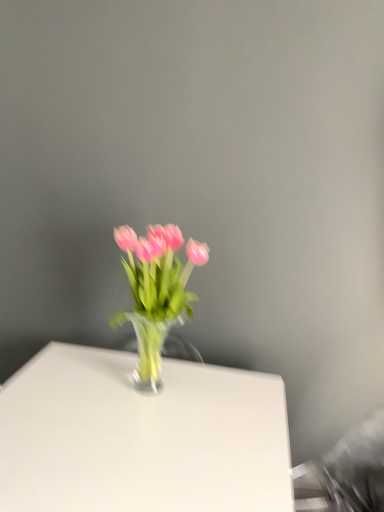
Identify the location of pink glass vase at center. This screenshot has width=384, height=512. (156, 292).

What do you see at coordinates (156, 292) in the screenshot? I see `pink glass vase at center` at bounding box center [156, 292].

Measure the distance between point (105, 392) and camera.

They are 3.97 feet apart.

Image resolution: width=384 pixels, height=512 pixels. Describe the element at coordinates (141, 437) in the screenshot. I see `white glossy table at center` at that location.

You are a GUI agent. You are given a task and a screenshot of the screen. Output one action in this format:
    pyautogui.click(x=<x>, y=<y>)
    Task: Click on the white glossy table at center
    This screenshot has height=512, width=384.
    Given the screenshot: What is the action you would take?
    pyautogui.click(x=141, y=437)

Find the location of a particular element. This screenshot has width=384, height=512. pink glass vase at center is located at coordinates (156, 292).

Between white glossy table at center and pink glass vase at center, which one appears on the right side from the viewer's perspective?

Positioned to the right is pink glass vase at center.

From the picture: Relative to pink glass vase at center, is white glossy table at center in front or behind?

white glossy table at center is in front of pink glass vase at center.

Does point (89, 468) lie in front of point (165, 230)?

Yes, point (89, 468) is closer to viewer.

From the image's perspective, is white glossy table at center above pink glass vase at center?

No.

From a real-world perspective, is white glossy table at center on top of pink glass vase at center?

No, from a real-world perspective, white glossy table at center is not above pink glass vase at center.

Which object is wider, white glossy table at center or pink glass vase at center?

Wider between the two is white glossy table at center.

From their relative heights in the image, would you say white glossy table at center is taller or shorter than pink glass vase at center?

Clearly, white glossy table at center is taller compared to pink glass vase at center.

Who is bigger, white glossy table at center or pink glass vase at center?

With larger size is white glossy table at center.

Is white glossy table at center completely or partially outside of pink glass vase at center?

white glossy table at center lies outside pink glass vase at center's area.

Is white glossy table at center placed right next to pink glass vase at center?

No, white glossy table at center is not beside pink glass vase at center.

Is white glossy table at center positioned with its back to pink glass vase at center?

No, white glossy table at center is not facing away from pink glass vase at center.

What are the coordinates of `floral arrangement above the white glossy table at center (from the image's perspective)` in the screenshot? It's located at (156, 292).

Which is more to the left, pink glass vase at center or white glossy table at center?

white glossy table at center.

Which object is closer to the camera taking this photo, pink glass vase at center or white glossy table at center?

white glossy table at center is more forward.

Is point (175, 250) less distant than point (259, 376)?

Yes.

From the image's perspective, who appears lower, pink glass vase at center or white glossy table at center?

From the image's view, white glossy table at center is below.

From a real-world perspective, between pink glass vase at center and white glossy table at center, who is vertically higher?

From a 3D spatial view, pink glass vase at center is above.

Is pink glass vase at center wider or thinner than white glossy table at center?

Clearly, pink glass vase at center has less width compared to white glossy table at center.

Considering the sizes of objects pink glass vase at center and white glossy table at center in the image provided, who is shorter, pink glass vase at center or white glossy table at center?

pink glass vase at center.

Considering the sizes of objects pink glass vase at center and white glossy table at center in the image provided, who is smaller, pink glass vase at center or white glossy table at center?

pink glass vase at center is smaller.

Is pink glass vase at center not inside white glossy table at center?

Indeed, pink glass vase at center is completely outside white glossy table at center.

Is pink glass vase at center next to white glossy table at center and touching it?

They are not placed beside each other.

Does pink glass vase at center turn towards white glossy table at center?

No, pink glass vase at center is not facing towards white glossy table at center.

How different are the orientations of pink glass vase at center and white glossy table at center in degrees?

They differ by 0.261 degrees in their facing directions.

The image size is (384, 512). I want to click on floral arrangement that appears on the right of white glossy table at center, so click(156, 292).

Where is `table that appears in front of the pink glass vase at center`? table that appears in front of the pink glass vase at center is located at coordinates (141, 437).

Identify the location of floral arrangement on the right of the white glossy table at center. (156, 292).